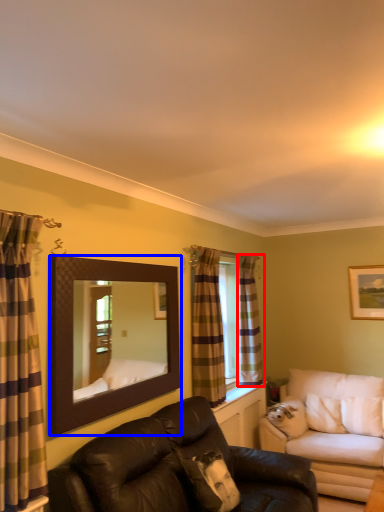
Question: Which of the following is the closest to the observer, curtain (highlighted by a red box) or mirror (highlighted by a blue box)?

Choices:
 (A) curtain
 (B) mirror

Answer: (B)